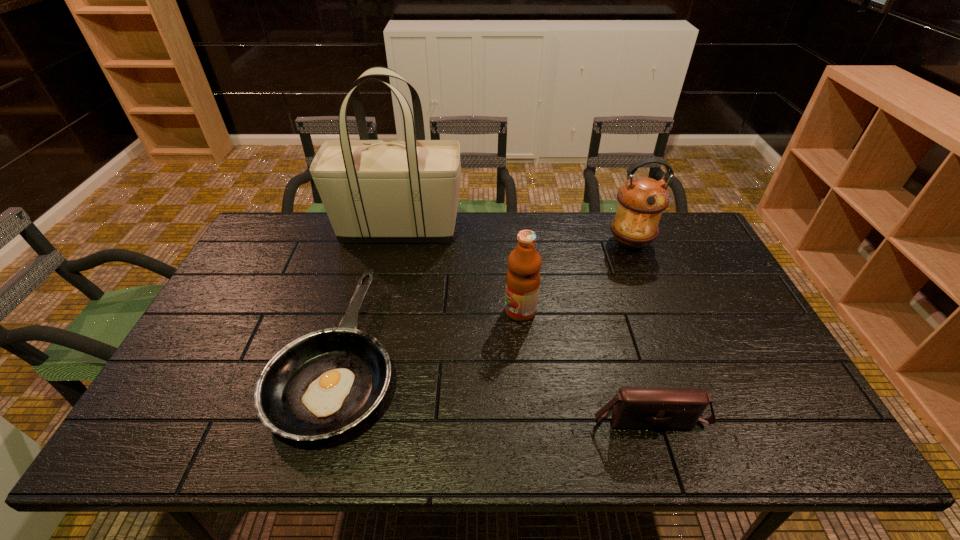
Find the location of a particular element. shopping bag is located at coordinates (374, 191).

Locate an element on the screen. The width and height of the screenshot is (960, 540). oil lamp is located at coordinates 642,200.

Image resolution: width=960 pixels, height=540 pixels. I want to click on fruit juice, so click(524, 263).

This screenshot has height=540, width=960. Find the location of `shoulder bag`. shoulder bag is located at coordinates (634, 407).

At what (x,y) coordinates should I click in order to perform the action: click on frying pan. Please return your answer as a coordinate pair (x, y). Looking at the image, I should click on (323, 383).

Image resolution: width=960 pixels, height=540 pixels. In order to click on vacant region located 0.080m with handles facing forward on the shopping bag in this screenshot , I will do `click(485, 230)`.

You are a GUI agent. You are given a task and a screenshot of the screen. Output one action in this format:
    pyautogui.click(x=<x>, y=<y>)
    Task: Click on the free location located on the front of the oil lamp
    The height and width of the screenshot is (540, 960).
    Given the screenshot: What is the action you would take?
    [x=670, y=345]

Find the location of a particular element. The image size is (960, 540). vacant space located on the front label of the third object from right to left is located at coordinates (449, 311).

You are a GUI agent. You are given a task and a screenshot of the screen. Output one action in this format:
    pyautogui.click(x=<x>, y=<y>)
    Task: Click on the free region located on the front label of the third object from right to left
    The height and width of the screenshot is (540, 960).
    Given the screenshot: What is the action you would take?
    point(443,311)

Find the location of a particular element. free space located on the front label of the third object from right to left is located at coordinates (405, 311).